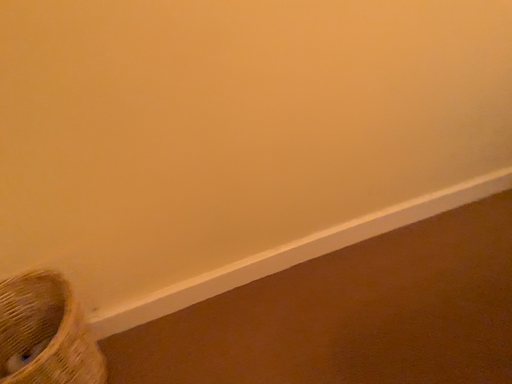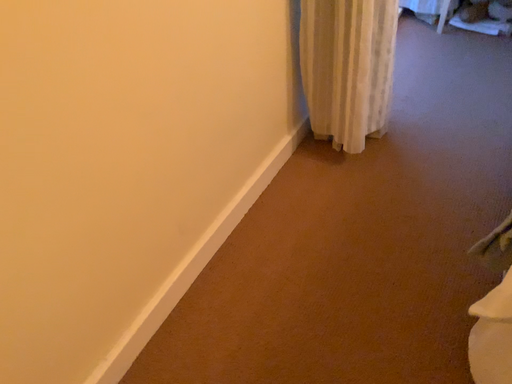
Question: How did the camera likely rotate when shooting the video?

Choices:
 (A) rotated left
 (B) rotated right

Answer: (B)